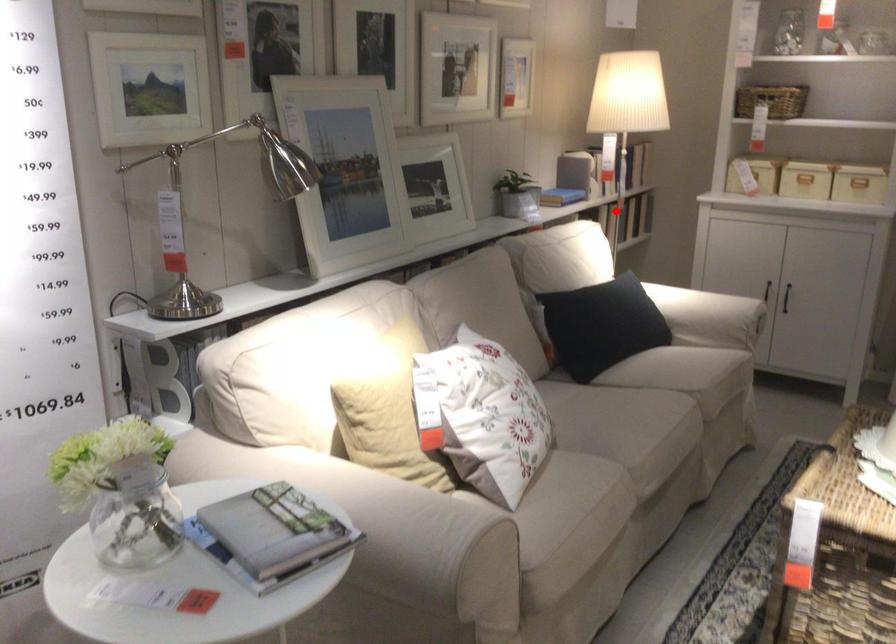
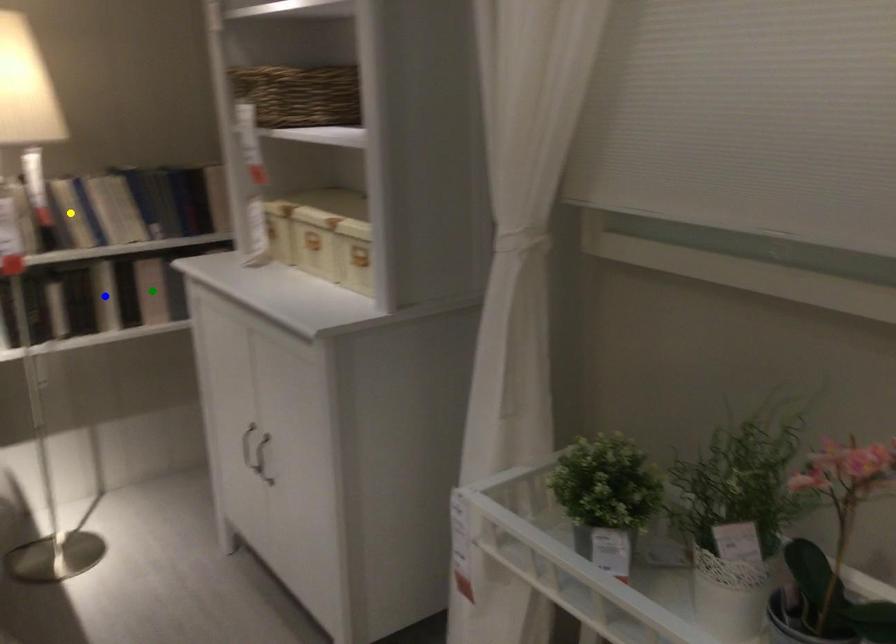
Question: I am providing you with two images of the same scene from different viewpoints. A red point is marked on the first image. You are given multiple points on the second image. In image 2, which mark is for the same physical point as the one in image 1?

Choices:
 (A) green point
 (B) blue point
 (C) yellow point

Answer: (B)